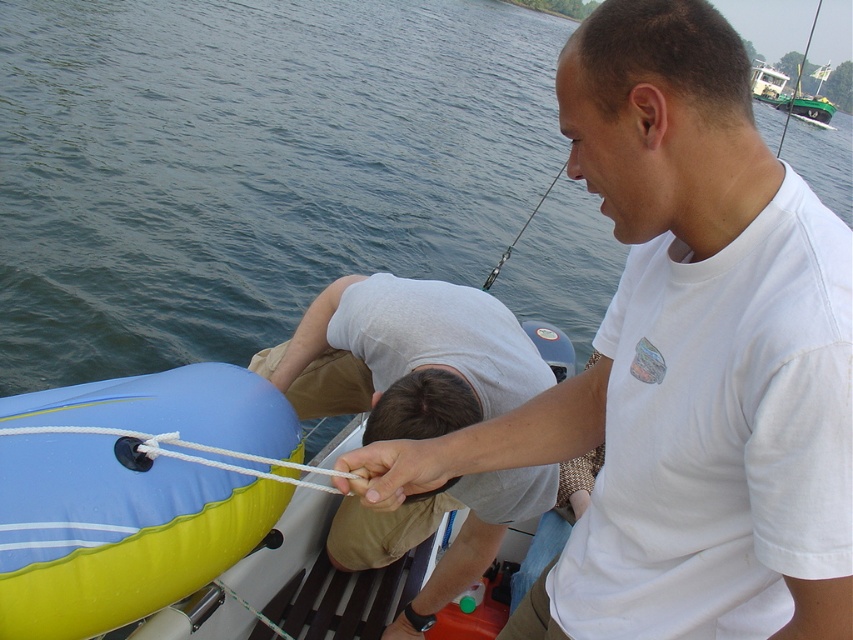
Which is more to the left, blue rubber boat at lower left or white cotton t-shirt at center?

From the viewer's perspective, white cotton t-shirt at center appears more on the left side.

Does blue rubber boat at lower left lie in front of white cotton t-shirt at center?

No, blue rubber boat at lower left is further to the viewer.

Is point (20, 156) behind point (772, 378)?

That is True.

Find the location of `blue rubber boat at lower left`. blue rubber boat at lower left is located at coordinates (250, 166).

Between white cotton t-shirt at center and white rope at lower left, which one is positioned higher?

white cotton t-shirt at center is above.

Does white cotton t-shirt at center have a smaller size compared to white rope at lower left?

Actually, white cotton t-shirt at center might be larger than white rope at lower left.

Who is more forward, (578, 108) or (80, 433)?

Positioned in front is point (578, 108).

The width and height of the screenshot is (853, 640). Identify the location of white cotton t-shirt at center. (683, 360).

In the scene shown: Who is lower down, white cotton t-shirt at center or green plastic boat at upper right?

Positioned lower is white cotton t-shirt at center.

Does white cotton t-shirt at center have a larger size compared to green plastic boat at upper right?

No.

Is point (682, 435) less distant than point (822, 97)?

Yes, it is in front of point (822, 97).

At what (x,y) coordinates should I click in order to perform the action: click on white cotton t-shirt at center. Please return your answer as a coordinate pair (x, y). This screenshot has height=640, width=853. Looking at the image, I should click on (683, 360).